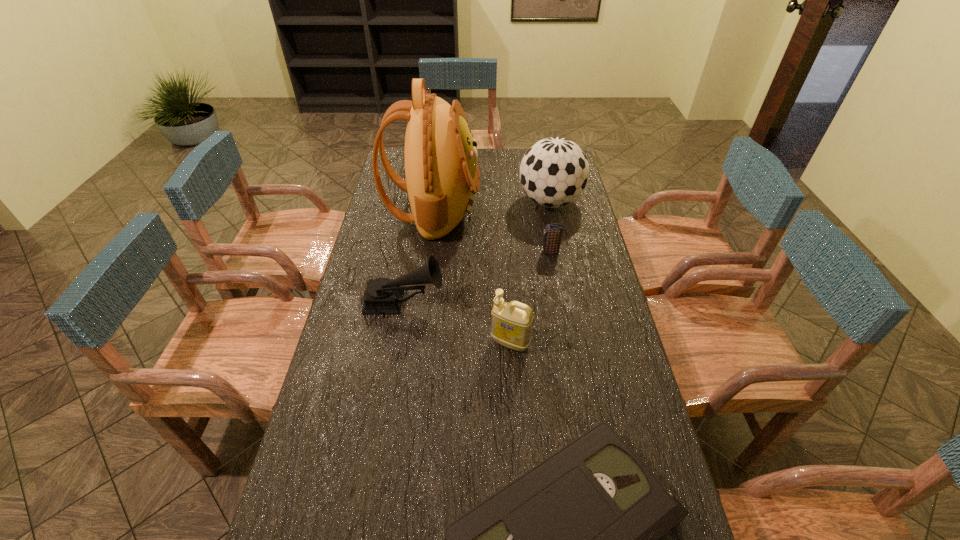
Locate an element on the screen. This screenshot has width=960, height=540. empty location between the second shortest object and the detergent is located at coordinates (531, 298).

You are a GUI agent. You are given a task and a screenshot of the screen. Output one action in this format:
    pyautogui.click(x=<x>, y=<y>)
    Task: Click on the free space between the phonograph_record and the soccer ball
    
    Given the screenshot: What is the action you would take?
    pyautogui.click(x=477, y=253)

Find the location of `empty location between the backpack and the fifth tallest object`. empty location between the backpack and the fifth tallest object is located at coordinates (492, 231).

You are a GUI agent. You are given a task and a screenshot of the screen. Output one action in this format:
    pyautogui.click(x=<x>, y=<y>)
    Task: Click on the free space between the fourth nearest object and the backpack
    The image size is (960, 540).
    Given the screenshot: What is the action you would take?
    pyautogui.click(x=492, y=231)

Locate an element on the screen. Image resolution: width=960 pixels, height=540 pixels. vacant area between the fifth tallest object and the third nearest object is located at coordinates (478, 278).

At what (x,y) coordinates should I click in order to perform the action: click on object that ranks as the fifth closest to the soccer ball. Please return your answer as a coordinate pair (x, y). This screenshot has width=960, height=540. Looking at the image, I should click on (577, 539).

This screenshot has height=540, width=960. What are the coordinates of `the fifth closest object to the tallest object` in the screenshot? It's located at (577, 539).

What are the coordinates of `free region that satisfies the following two spatial constraints: 1. on the back side of the detergent; 2. from the horn of the phonograph_record` in the screenshot? It's located at (508, 303).

The height and width of the screenshot is (540, 960). I want to click on free space in the image that satisfies the following two spatial constraints: 1. from the horn of the phonograph_record; 2. on the back side of the detergent, so click(397, 343).

Locate an element on the screen. This screenshot has height=540, width=960. free spot that satisfies the following two spatial constraints: 1. on the front-facing side of the tallest object; 2. on the back side of the second nearest object is located at coordinates (416, 343).